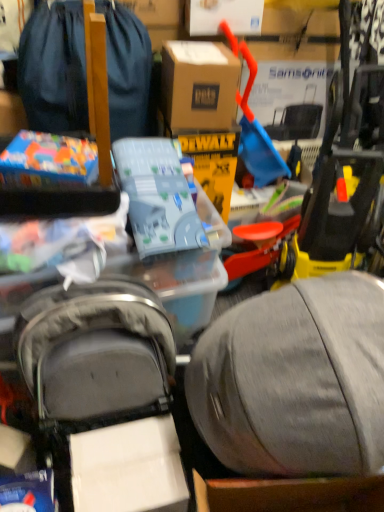
Question: Are matte plastic toy at upper left, marked as the first toy in a left-to-right arrangement, and translucent plastic toy at center, which appears as the first toy when viewed from the right, located far from each other?

Choices:
 (A) yes
 (B) no

Answer: (B)

Question: Is matte plastic toy at upper left, marked as the first toy in a left-to-right arrangement, completely or partially outside of translucent plastic toy at center, which appears as the first toy when viewed from the right?

Choices:
 (A) yes
 (B) no

Answer: (A)

Question: Does matte plastic toy at upper left, the second toy from the right, have a greater width compared to translucent plastic toy at center, which appears as the first toy when viewed from the right?

Choices:
 (A) yes
 (B) no

Answer: (B)

Question: Is matte plastic toy at upper left, marked as the first toy in a left-to-right arrangement, positioned before translucent plastic toy at center, which is the second toy in left-to-right order?

Choices:
 (A) no
 (B) yes

Answer: (A)

Question: Can you confirm if matte plastic toy at upper left, marked as the first toy in a left-to-right arrangement, is smaller than translucent plastic toy at center, which is the second toy in left-to-right order?

Choices:
 (A) no
 (B) yes

Answer: (B)

Question: Is translucent plastic toy at center, which is the second toy in left-to-right order, inside matte plastic toy at upper left, the second toy from the right?

Choices:
 (A) no
 (B) yes

Answer: (A)

Question: Does matte plastic toy at upper left, the second toy from the right, have a lesser height compared to brown cardboard box at center?

Choices:
 (A) yes
 (B) no

Answer: (A)

Question: Does matte plastic toy at upper left, marked as the first toy in a left-to-right arrangement, appear on the left side of brown cardboard box at center?

Choices:
 (A) no
 (B) yes

Answer: (B)

Question: Is matte plastic toy at upper left, marked as the first toy in a left-to-right arrangement, positioned behind brown cardboard box at center?

Choices:
 (A) yes
 (B) no

Answer: (B)

Question: From the image's perspective, does matte plastic toy at upper left, the second toy from the right, appear lower than brown cardboard box at center?

Choices:
 (A) yes
 (B) no

Answer: (A)

Question: Does matte plastic toy at upper left, marked as the first toy in a left-to-right arrangement, have a greater width compared to brown cardboard box at center?

Choices:
 (A) no
 (B) yes

Answer: (A)

Question: From a real-world perspective, is matte plastic toy at upper left, marked as the first toy in a left-to-right arrangement, beneath brown cardboard box at center?

Choices:
 (A) yes
 (B) no

Answer: (A)

Question: Does matte black backpack at upper left have a larger size compared to matte plastic toy at upper left, the second toy from the right?

Choices:
 (A) yes
 (B) no

Answer: (A)